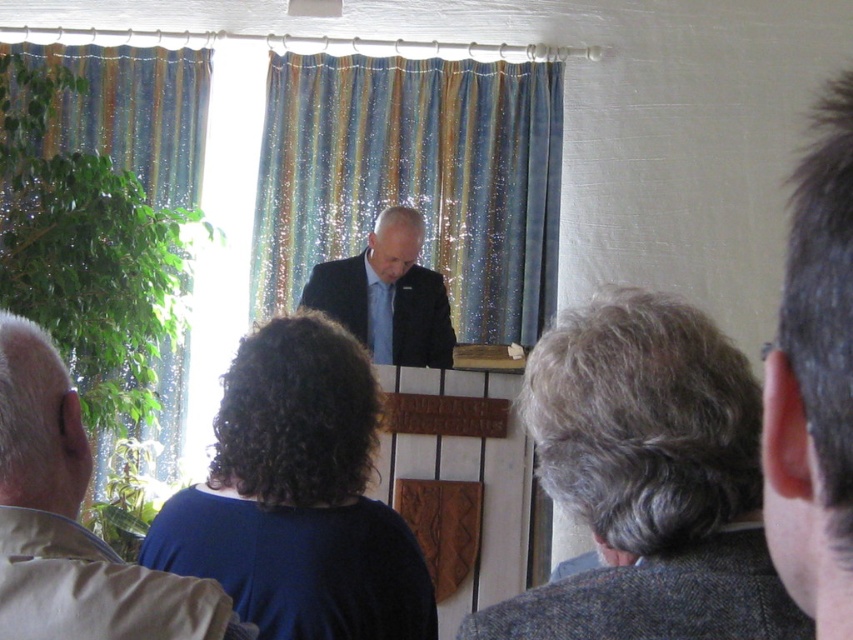
Question: Considering the real-world distances, which object is closest to the matte black suit at center?

Choices:
 (A) gray woolen jacket at lower right
 (B) gray woolen suit at lower right
 (C) striped fabric curtain at left

Answer: (C)

Question: Is blue striped curtain at center positioned behind striped fabric curtain at left?

Choices:
 (A) no
 (B) yes

Answer: (B)

Question: Does blue striped curtain at center appear over striped fabric curtain at left?

Choices:
 (A) no
 (B) yes

Answer: (B)

Question: Is gray woolen jacket at lower right below dark blue fabric at center?

Choices:
 (A) no
 (B) yes

Answer: (A)

Question: Which object appears closest to the camera in this image?

Choices:
 (A) gray woolen jacket at lower right
 (B) blue striped curtain at center
 (C) dark blue fabric at center
 (D) striped fabric curtain at left

Answer: (A)

Question: Which object is the farthest from the light brown leather jacket at lower left?

Choices:
 (A) gray woolen suit at lower right
 (B) blue striped curtain at center
 (C) dark blue fabric at center
 (D) gray woolen jacket at lower right

Answer: (B)